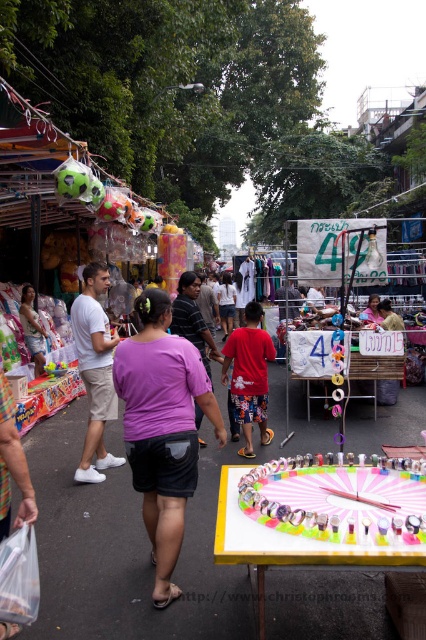
Question: Which point appears closest to the camera in this image?

Choices:
 (A) (85, 385)
 (B) (135, 346)

Answer: (B)

Question: Which point is closer to the camera?

Choices:
 (A) (270, 433)
 (B) (97, 323)
 (C) (164, 388)

Answer: (C)

Question: Based on their relative distances, which object is nearer to the white matte t-shirt at center?

Choices:
 (A) red cotton shirt at center
 (B) purple cotton shirt at center

Answer: (A)

Question: Does purple cotton shirt at center appear on the left side of white matte t-shirt at center?

Choices:
 (A) yes
 (B) no

Answer: (B)

Question: Is white matte t-shirt at center to the right of red cotton shirt at center from the viewer's perspective?

Choices:
 (A) no
 (B) yes

Answer: (A)

Question: In this image, where is purple cotton shirt at center located relative to white matte t-shirt at center?

Choices:
 (A) below
 (B) above

Answer: (A)